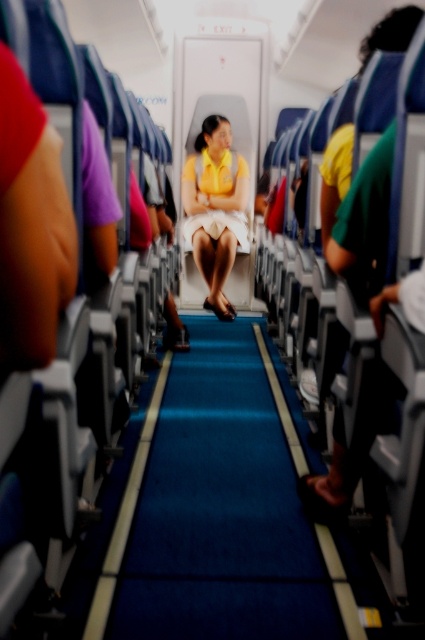
Identify the location of blue carpet at center. click(220, 513).

Which is in front, point (215, 586) or point (187, 157)?

Point (215, 586)

This screenshot has height=640, width=425. What are the coordinates of `blue carpet at center` in the screenshot? It's located at (220, 513).